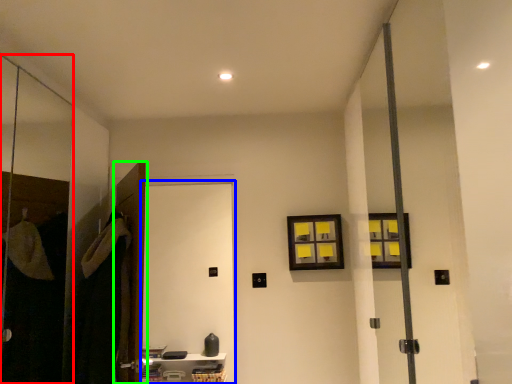
Question: Considering the real-world distances, which object is closest to screen door (highlighted by a red box)? screen door (highlighted by a blue box) or door (highlighted by a green box).

Choices:
 (A) screen door
 (B) door

Answer: (B)